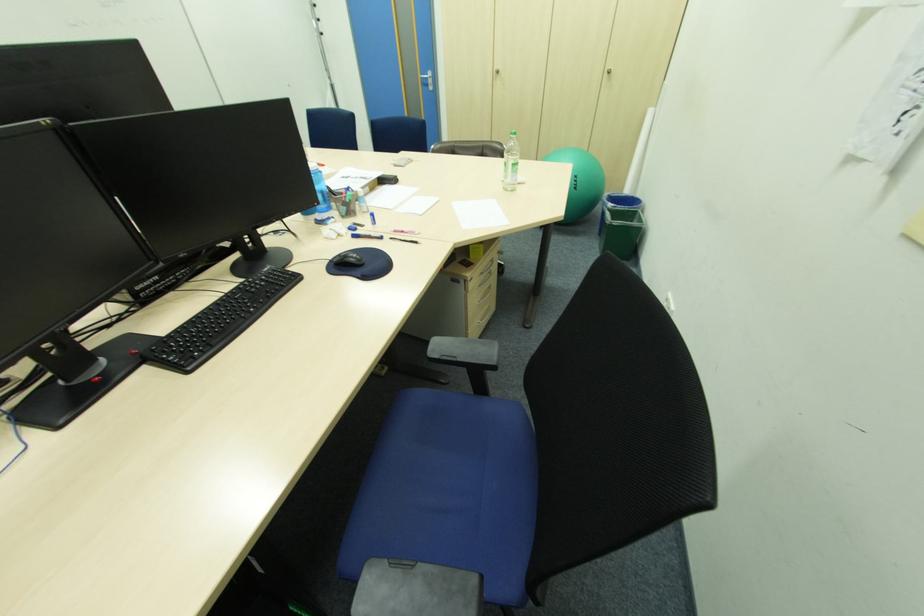
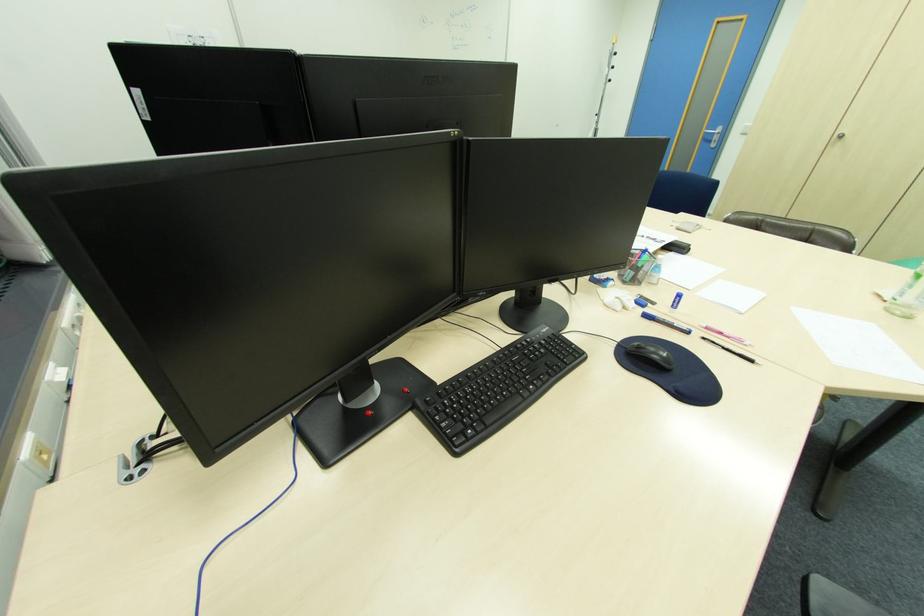
Where in the second image is the point corresponding to pixel 400 232 from the first image?

(712, 328)